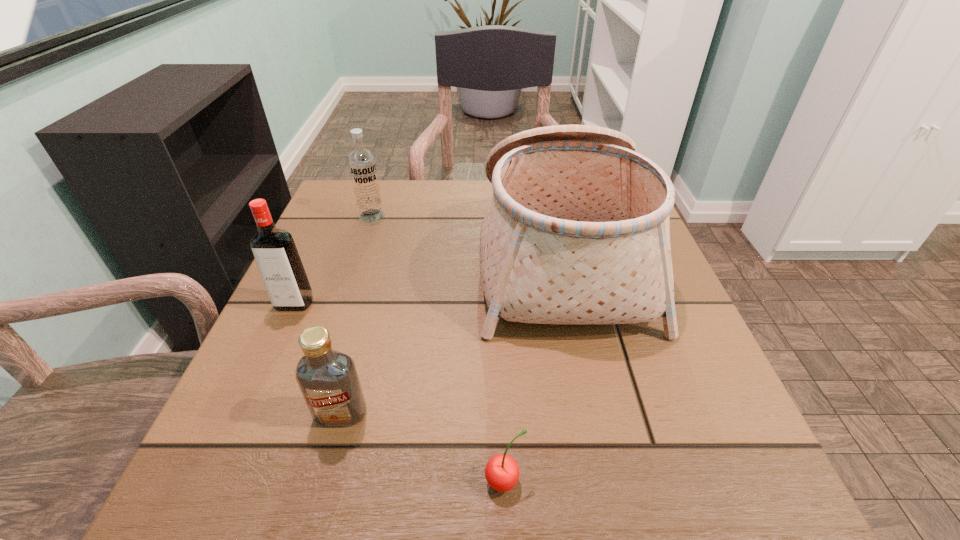
I want to click on object positioned at the far right corner, so click(577, 231).

Locate an element on the screen. This screenshot has width=960, height=540. free location at the far edge is located at coordinates (476, 190).

At what (x,y) coordinates should I click in order to perform the action: click on vacant position at the near edge of the desktop. Please return your answer as a coordinate pair (x, y). This screenshot has width=960, height=540. Looking at the image, I should click on (457, 503).

In the image, there is a desktop. Identify the location of vacant space at the left edge. (362, 241).

Locate an element on the screen. free space at the right edge is located at coordinates (692, 430).

Identify the location of free spot at the far left corner of the desktop. This screenshot has height=540, width=960. (346, 230).

Where is `vacant space at the near left corner of the desktop`? The width and height of the screenshot is (960, 540). vacant space at the near left corner of the desktop is located at coordinates (225, 474).

Where is `free spot at the near right corner of the desktop`? The width and height of the screenshot is (960, 540). free spot at the near right corner of the desktop is located at coordinates (728, 485).

I want to click on unoccupied area between the tallest object and the farthest vodka, so click(x=467, y=235).

The height and width of the screenshot is (540, 960). I want to click on unoccupied position between the cherry and the basket, so click(x=533, y=369).